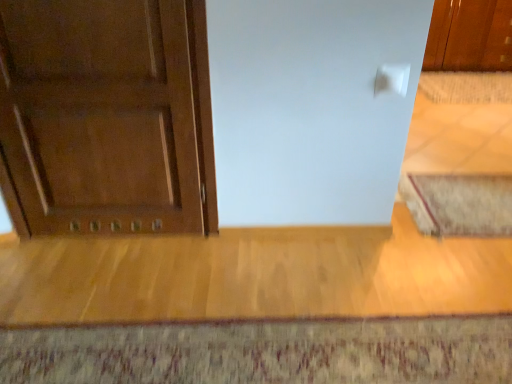
At what (x,y) coordinates should I click in order to perform the action: click on empty space that is in between matte wood door at left and textured wool doormat at lower center, arranged as the 1th doormat when ordered from the bottom. Please return your answer as a coordinate pair (x, y). Looking at the image, I should click on (195, 281).